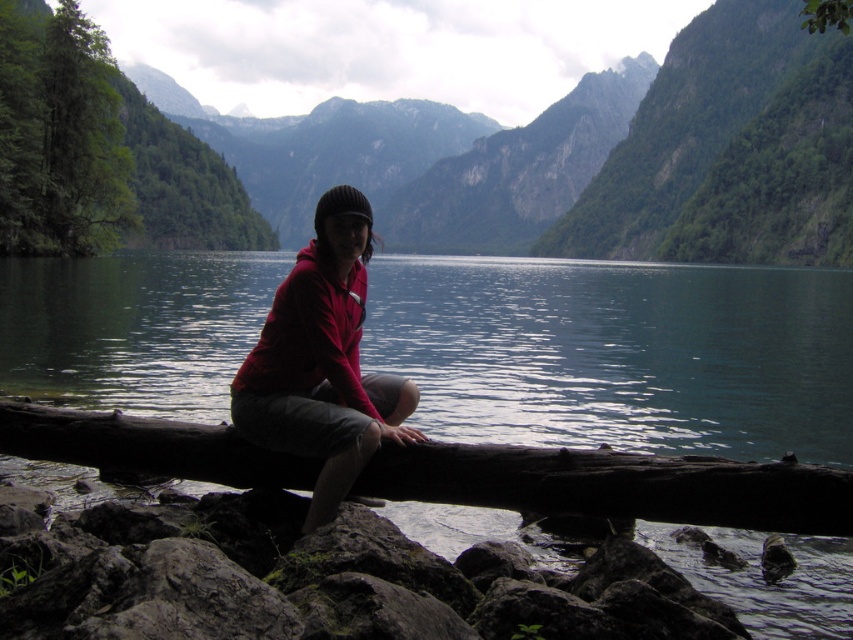
Question: Estimate the real-world distances between objects in this image. Which object is closer to the rough gray rock at lower left?

Choices:
 (A) matte red hoodie at center
 (B) green leafy tree at upper center

Answer: (A)

Question: Based on their relative distances, which object is nearer to the matte red hoodie at center?

Choices:
 (A) green leafy tree at left
 (B) rough gray rock at lower left
 (C) green leafy tree at upper center

Answer: (B)

Question: Does rough gray rock at lower left have a smaller size compared to green leafy tree at upper center?

Choices:
 (A) yes
 (B) no

Answer: (A)

Question: From the image, what is the correct spatial relationship of rough gray rock at lower left in relation to green leafy tree at left?

Choices:
 (A) above
 (B) below

Answer: (B)

Question: Does greenish-blue water at center have a greater width compared to green leafy tree at upper center?

Choices:
 (A) no
 (B) yes

Answer: (B)

Question: Among these points, which one is nearest to the camera?

Choices:
 (A) (659, 179)
 (B) (51, 186)

Answer: (B)